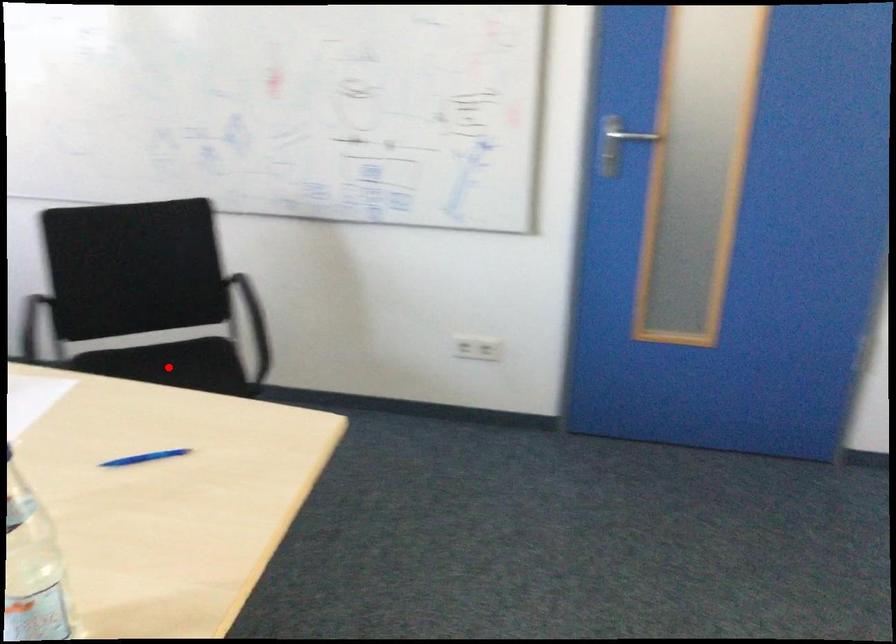
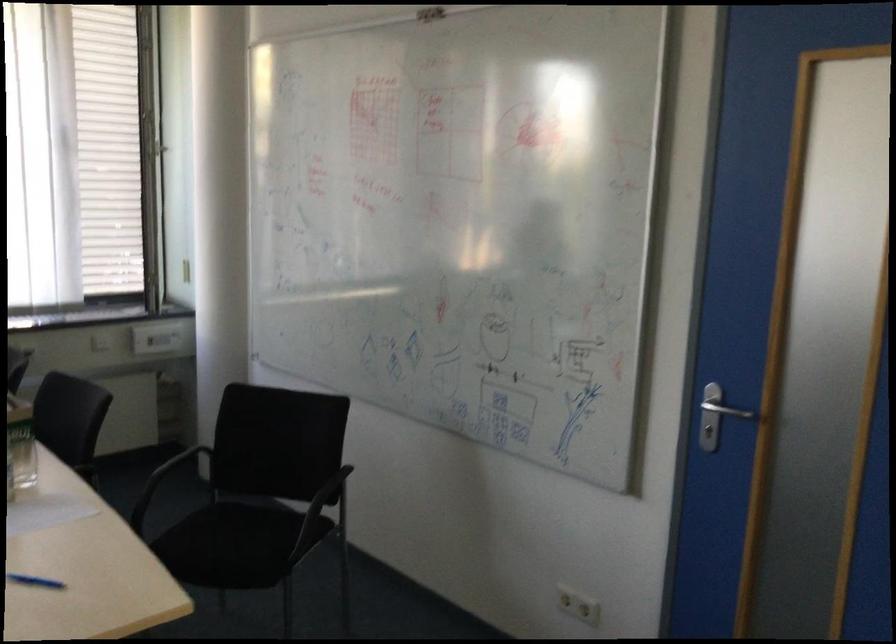
Question: I am providing you with two images of the same scene from different viewpoints. A red point is shown in image1. For the corresponding object point in image2, is it positioned nearer or farther from the camera?

Choices:
 (A) Nearer
 (B) Farther

Answer: (B)